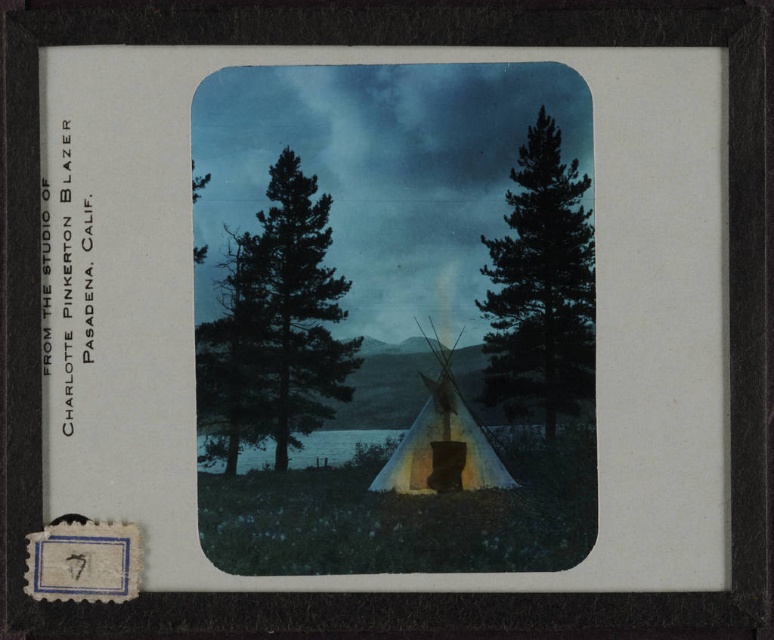
Question: Which of the following is the closest to the observer?

Choices:
 (A) (564, 358)
 (B) (392, 444)
 (C) (238, 369)
 (D) (466, 480)

Answer: (B)

Question: Which of the following is the farthest from the observer?

Choices:
 (A) (307, 177)
 (B) (426, 342)
 (C) (502, 428)

Answer: (B)

Question: Does green matte tree at right have a larger size compared to white canvas tent at center?

Choices:
 (A) no
 (B) yes

Answer: (B)

Question: Which object is positioned farthest from the green matte tree at right?

Choices:
 (A) green matte tree at center
 (B) white canvas tent at center
 (C) blue water at center

Answer: (A)

Question: Does green matte tree at center have a greater width compared to green matte tree at right?

Choices:
 (A) no
 (B) yes

Answer: (B)

Question: Does green matte tree at center appear under white canvas tent at center?

Choices:
 (A) yes
 (B) no

Answer: (B)